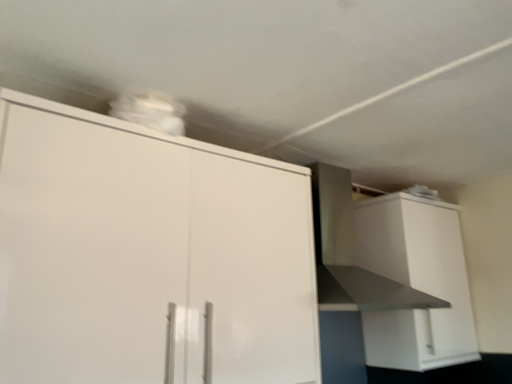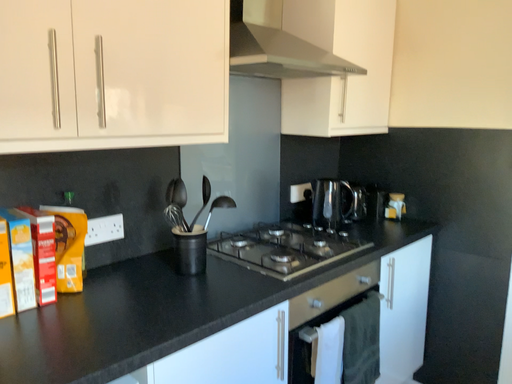
Question: Which way did the camera rotate in the video?

Choices:
 (A) rotated downward
 (B) rotated upward

Answer: (A)